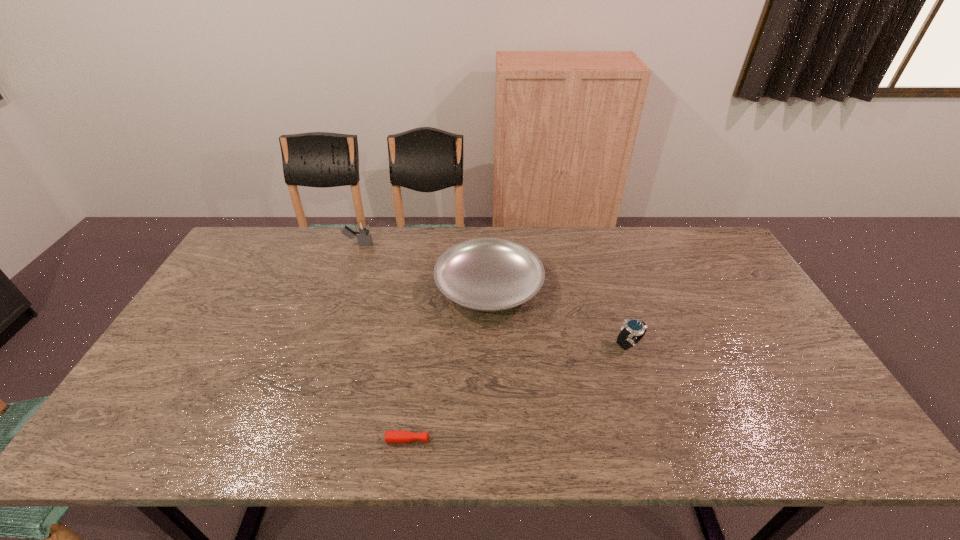
Identify the location of the leftmost object. (364, 237).

What are the coordinates of `the tallest object` in the screenshot? It's located at (364, 237).

The height and width of the screenshot is (540, 960). What are the coordinates of `the rightmost object` in the screenshot? It's located at (633, 329).

Where is `watch`? The image size is (960, 540). watch is located at coordinates (633, 329).

At what (x,y) coordinates should I click in order to perform the action: click on bedpan. Please return your answer as a coordinate pair (x, y). Looking at the image, I should click on (486, 274).

Locate an element on the screen. Image resolution: width=960 pixels, height=540 pixels. screwdriver is located at coordinates (400, 436).

You are a GUI agent. You are given a task and a screenshot of the screen. Output one action in this format:
    pyautogui.click(x=<x>, y=<y>)
    Task: Click on the shortest object
    
    Given the screenshot: What is the action you would take?
    pyautogui.click(x=400, y=436)

Locate an element on the screen. free spot located 0.130m on the right of the leftmost object is located at coordinates (410, 244).

Where is `vacant space located on the left of the watch`? The height and width of the screenshot is (540, 960). vacant space located on the left of the watch is located at coordinates (521, 344).

Where is `free space located on the left of the bedpan`? This screenshot has width=960, height=540. free space located on the left of the bedpan is located at coordinates (420, 287).